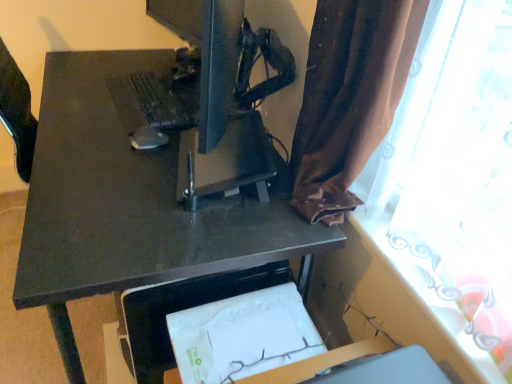
Question: From the image's perspective, would you say matte black monitor at center is shown under matte black keyboard at upper left?

Choices:
 (A) no
 (B) yes

Answer: (A)

Question: Is matte black monitor at center not inside matte black keyboard at upper left?

Choices:
 (A) no
 (B) yes

Answer: (B)

Question: Does matte black monitor at center have a smaller size compared to matte black keyboard at upper left?

Choices:
 (A) yes
 (B) no

Answer: (B)

Question: From the image's perspective, is matte black monitor at center on top of matte black keyboard at upper left?

Choices:
 (A) yes
 (B) no

Answer: (A)

Question: Is matte black monitor at center not close to matte black keyboard at upper left?

Choices:
 (A) no
 (B) yes

Answer: (A)

Question: Is point (232, 84) closer or farther from the camera than point (477, 203)?

Choices:
 (A) farther
 (B) closer

Answer: (A)

Question: In the image, is matte black monitor at center positioned in front of or behind brown fabric curtain at upper right?

Choices:
 (A) behind
 (B) front

Answer: (A)

Question: From the image's perspective, relative to brown fabric curtain at upper right, is matte black monitor at center above or below?

Choices:
 (A) below
 (B) above

Answer: (B)

Question: Choose the correct answer: Is matte black monitor at center inside brown fabric curtain at upper right or outside it?

Choices:
 (A) inside
 (B) outside

Answer: (B)

Question: In the image, is matte black mouse at center positioned in front of or behind brown fabric curtain at upper right?

Choices:
 (A) behind
 (B) front

Answer: (A)

Question: In terms of width, does matte black mouse at center look wider or thinner when compared to brown fabric curtain at upper right?

Choices:
 (A) thin
 (B) wide

Answer: (B)

Question: Is matte black mouse at center taller or shorter than brown fabric curtain at upper right?

Choices:
 (A) short
 (B) tall

Answer: (A)

Question: Which is correct: matte black mouse at center is inside brown fabric curtain at upper right, or outside of it?

Choices:
 (A) inside
 (B) outside

Answer: (B)

Question: Is matte black monitor at center in front of or behind matte black keyboard at upper left in the image?

Choices:
 (A) behind
 (B) front

Answer: (B)

Question: Is matte black monitor at center to the left or to the right of matte black keyboard at upper left in the image?

Choices:
 (A) left
 (B) right

Answer: (B)